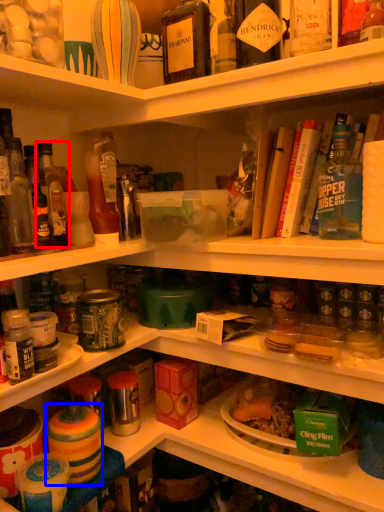
Question: Which point is further to the camera, bottle (highlighted by a red box) or food (highlighted by a blue box)?

Choices:
 (A) bottle
 (B) food

Answer: (A)